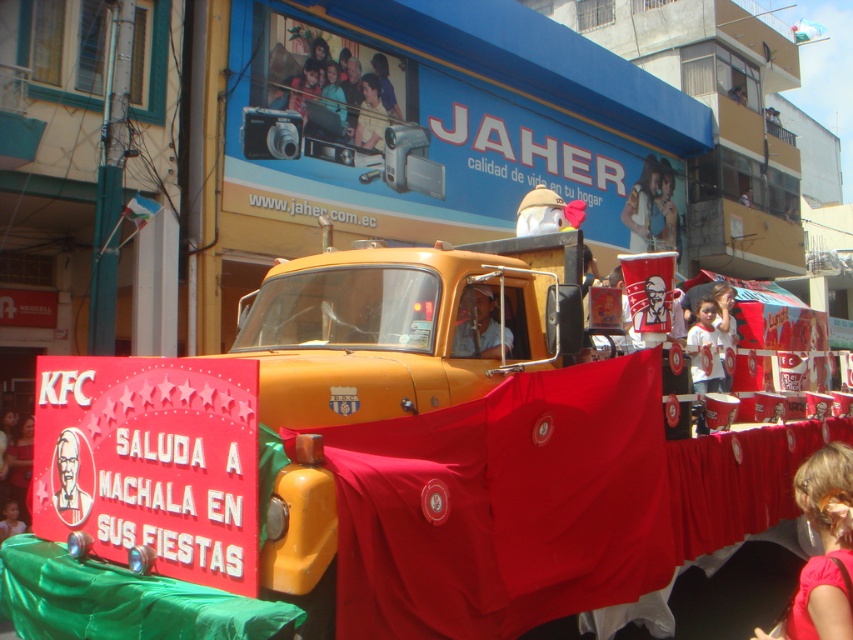
Who is positioned more to the right, matte yellow truck at center or smooth skin face at lower left?

matte yellow truck at center

Is point (486, 339) less distant than point (16, 512)?

Yes, it is.

Locate an element on the screen. matte yellow truck at center is located at coordinates (479, 326).

Is point (517, 320) positioned after point (645, 157)?

No, (517, 320) is in front of (645, 157).

This screenshot has width=853, height=640. In order to click on matte orange truck at center in this screenshot , I will do `click(386, 465)`.

Who is taller, matte black laptop at upper center or yellow plastic camera at upper center?

matte black laptop at upper center is taller.

Is matte black laptop at upper center wider than yellow plastic camera at upper center?

Correct, the width of matte black laptop at upper center exceeds that of yellow plastic camera at upper center.

Is point (282, 52) farther from camera compared to point (376, 145)?

No.

The image size is (853, 640). Identify the location of matte black laptop at upper center. (338, 84).